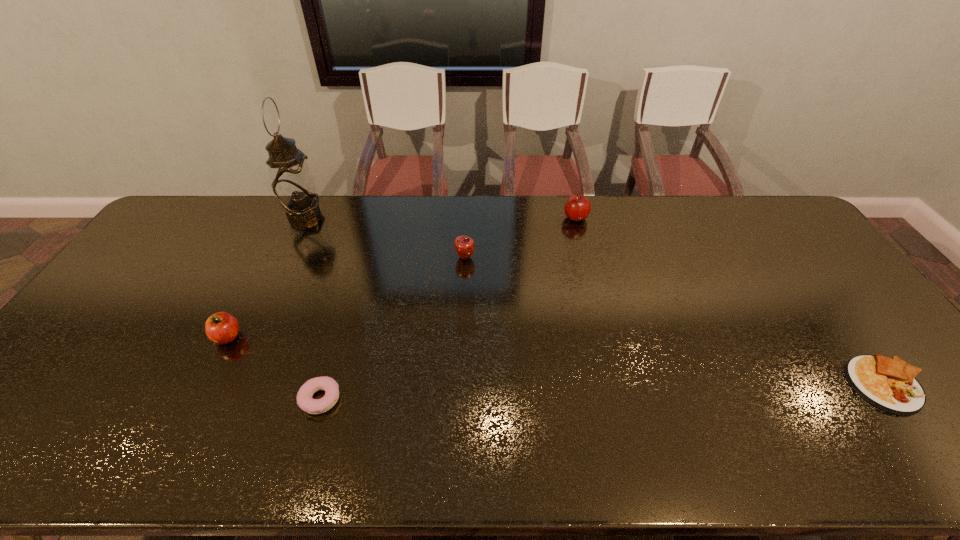
In order to click on oil lamp in this screenshot , I will do `click(292, 182)`.

This screenshot has width=960, height=540. Identify the location of the tallest apple. (578, 207).

At what (x,y) coordinates should I click in order to perform the action: click on the rightmost apple. Please return your answer as a coordinate pair (x, y). The width and height of the screenshot is (960, 540). Looking at the image, I should click on (578, 207).

Identify the location of the third object from right to left. (464, 245).

The height and width of the screenshot is (540, 960). What are the coordinates of `the fourth nearest object` in the screenshot? It's located at (464, 245).

The width and height of the screenshot is (960, 540). In order to click on the leftmost apple in this screenshot , I will do `click(221, 328)`.

You are a GUI agent. You are given a task and a screenshot of the screen. Output one action in this format:
    pyautogui.click(x=<x>, y=<y>)
    Task: Click on the third nearest object
    The height and width of the screenshot is (540, 960).
    Given the screenshot: What is the action you would take?
    pyautogui.click(x=221, y=328)

The height and width of the screenshot is (540, 960). Identify the location of the third object from left to right. (305, 401).

Where is `the second shortest object`? the second shortest object is located at coordinates (305, 401).

This screenshot has width=960, height=540. Find the location of `omelet`. omelet is located at coordinates (889, 384).